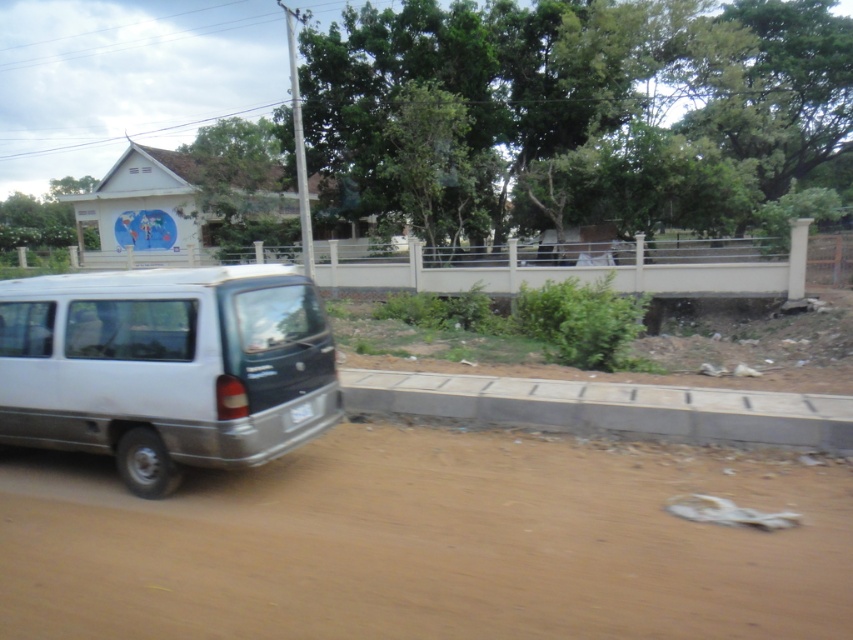
Can you confirm if brown dirt track at lower left is taller than white matte minivan at lower left?

Incorrect, brown dirt track at lower left's height is not larger of white matte minivan at lower left's.

Does point (195, 582) lie in front of point (15, 304)?

Yes, point (195, 582) is closer to viewer.

Between point (846, 576) and point (184, 326), which one is positioned behind?

Point (184, 326)

Where is `brown dirt track at lower left`? Image resolution: width=853 pixels, height=640 pixels. brown dirt track at lower left is located at coordinates pos(426,541).

Between white matte minivan at lower left and gray concrete curb at lower center, which one appears on the left side from the viewer's perspective?

Positioned to the left is white matte minivan at lower left.

Where is `white matte minivan at lower left`? The height and width of the screenshot is (640, 853). white matte minivan at lower left is located at coordinates (166, 368).

Who is shorter, brown dirt track at lower left or gray concrete curb at lower center?

With less height is brown dirt track at lower left.

Does point (521, 516) come farther from viewer compared to point (515, 397)?

No, (521, 516) is closer to viewer.

In order to click on brown dirt track at lower left in this screenshot , I will do `click(426, 541)`.